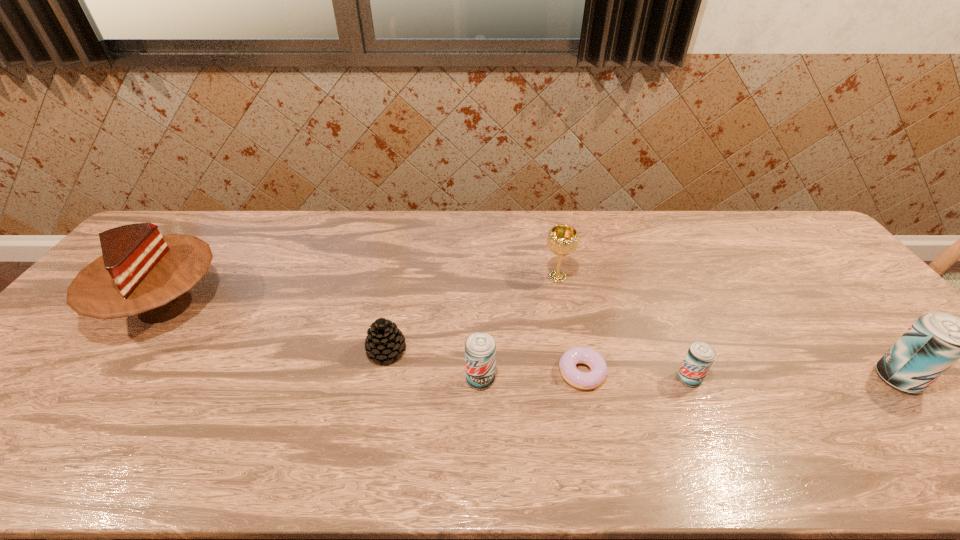
Find the location of a particular element. free area in between the tallest beer can and the second object from left to right is located at coordinates (642, 364).

Identify the location of free space between the chalice and the cake. (361, 292).

Locate an element on the screen. free spot between the third object from left to right and the chalice is located at coordinates (518, 328).

The image size is (960, 540). Find the location of `object that stands as the fifth closest to the chalice`. object that stands as the fifth closest to the chalice is located at coordinates (936, 340).

Find the location of a particular element. object that stands as the fourth closest to the second object from right to left is located at coordinates (480, 348).

This screenshot has width=960, height=540. Find the location of `the second closest beer can relative to the second object from right to left`. the second closest beer can relative to the second object from right to left is located at coordinates (480, 348).

Identify which beer can is located as the second nearest to the rightmost beer can. Please provide its 2D coordinates. Your answer should be formatted as a tuple, i.e. [(x, y)], where the tuple contains the x and y coordinates of a point satisfying the conditions above.

[(480, 348)]

Where is `vacant space that satisfies the following two spatial constraints: 1. at the narrow end of the pinecone; 2. on the right side of the sixth object from left to right`? vacant space that satisfies the following two spatial constraints: 1. at the narrow end of the pinecone; 2. on the right side of the sixth object from left to right is located at coordinates (x=381, y=379).

This screenshot has width=960, height=540. I want to click on free location that satisfies the following two spatial constraints: 1. at the narrow end of the pinecone; 2. on the left side of the sixth object from left to right, so click(381, 379).

Locate an element on the screen. free space that satisfies the following two spatial constraints: 1. at the narrow end of the pinecone; 2. on the left side of the second beer can from left to right is located at coordinates (381, 379).